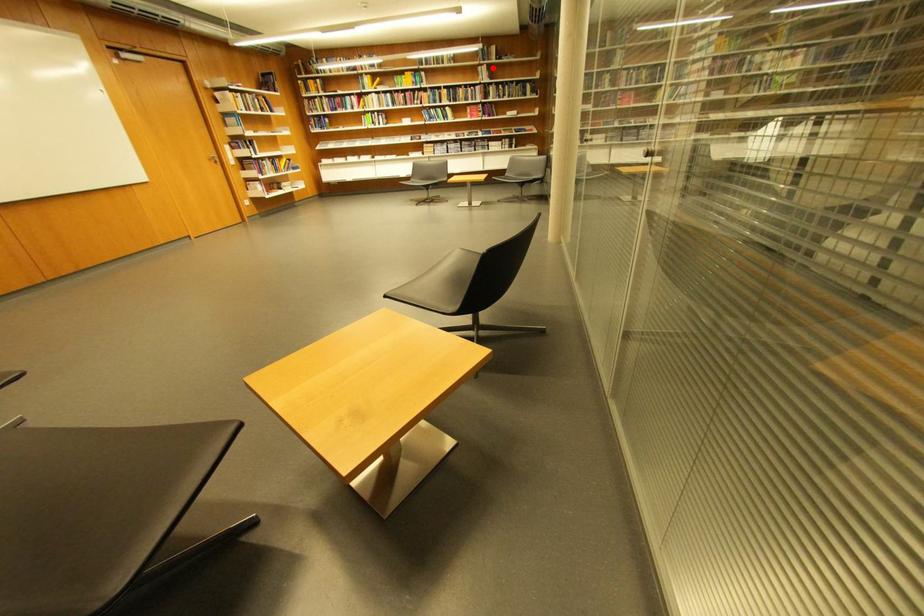
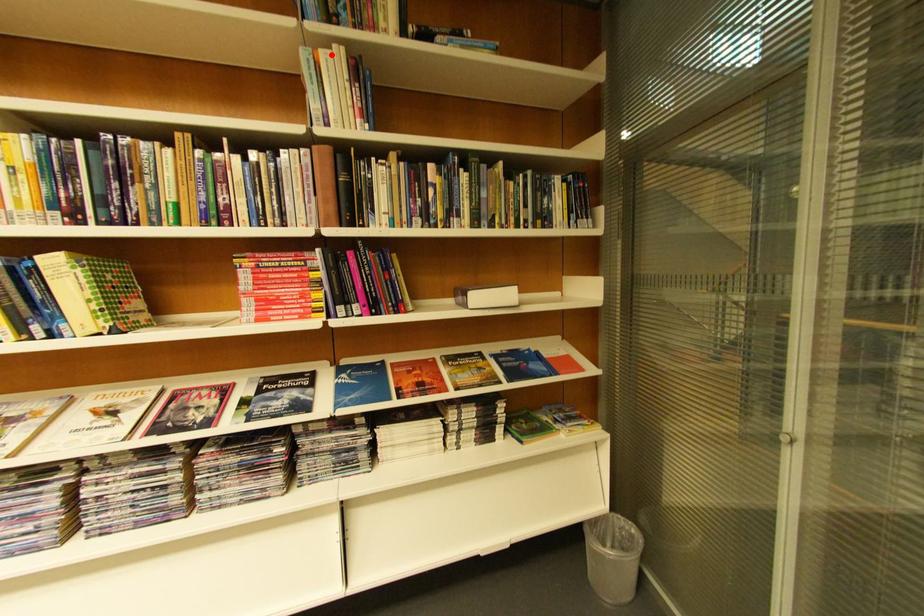
I am providing you with two images of the same scene from different viewpoints. A red point is marked on the first image and another point is marked on the second image. Does the point marked in image1 correspond to the same location as the one in image2?

Yes